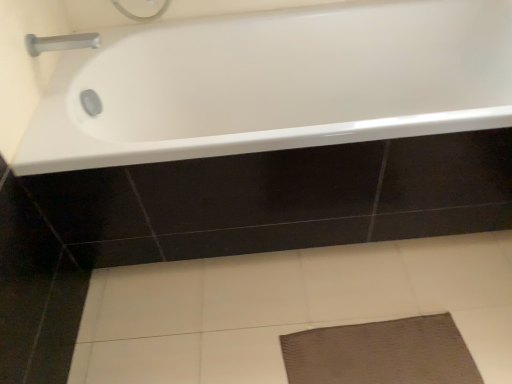
Question: Is white glossy bathtub at upper center beside silver metallic tap at upper left?

Choices:
 (A) no
 (B) yes

Answer: (A)

Question: Is white glossy bathtub at upper center outside silver metallic tap at upper left?

Choices:
 (A) yes
 (B) no

Answer: (A)

Question: Is white glossy bathtub at upper center bigger than silver metallic tap at upper left?

Choices:
 (A) yes
 (B) no

Answer: (A)

Question: Considering the relative positions of white glossy bathtub at upper center and silver metallic tap at upper left in the image provided, is white glossy bathtub at upper center to the left of silver metallic tap at upper left from the viewer's perspective?

Choices:
 (A) yes
 (B) no

Answer: (B)

Question: Is silver metallic tap at upper left at the back of white glossy bathtub at upper center?

Choices:
 (A) yes
 (B) no

Answer: (B)

Question: Does white glossy bathtub at upper center have a lesser height compared to silver metallic tap at upper left?

Choices:
 (A) yes
 (B) no

Answer: (B)

Question: Considering the relative sizes of silver metallic tap at upper left and white glossy bathtub at upper center in the image provided, is silver metallic tap at upper left thinner than white glossy bathtub at upper center?

Choices:
 (A) yes
 (B) no

Answer: (A)

Question: Is silver metallic tap at upper left smaller than white glossy bathtub at upper center?

Choices:
 (A) yes
 (B) no

Answer: (A)

Question: Is silver metallic tap at upper left surrounding white glossy bathtub at upper center?

Choices:
 (A) no
 (B) yes

Answer: (A)

Question: Can you confirm if silver metallic tap at upper left is wider than white glossy bathtub at upper center?

Choices:
 (A) no
 (B) yes

Answer: (A)

Question: From a real-world perspective, is silver metallic tap at upper left beneath white glossy bathtub at upper center?

Choices:
 (A) no
 (B) yes

Answer: (A)

Question: Is white glossy bathtub at upper center at the back of silver metallic tap at upper left?

Choices:
 (A) no
 (B) yes

Answer: (A)

Question: Is white glossy bathtub at upper center wider or thinner than silver metallic tap at upper left?

Choices:
 (A) thin
 (B) wide

Answer: (B)